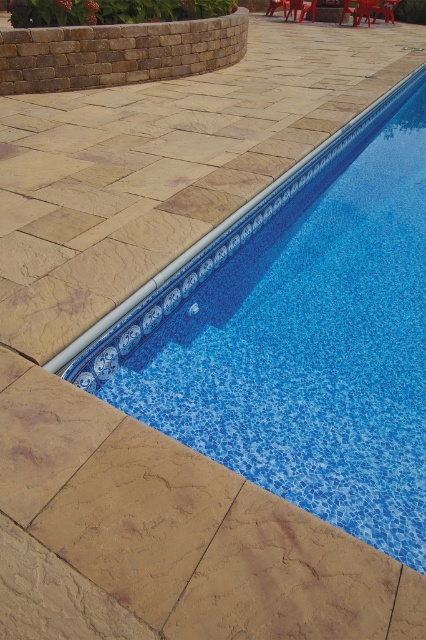
Question: Among these objects, which one is nearest to the camera?

Choices:
 (A) matte plastic chair at upper right
 (B) blue glossy pool at center
 (C) brown plastic chair at upper center

Answer: (B)

Question: Does blue glossy pool at center appear on the left side of wooden chair at upper center?

Choices:
 (A) no
 (B) yes

Answer: (B)

Question: Is blue glossy pool at center wider than wooden chair at upper center?

Choices:
 (A) no
 (B) yes

Answer: (B)

Question: Which of these objects is positioned farthest from the blue glossy pool at center?

Choices:
 (A) wooden chair at upper center
 (B) brown plastic chair at upper center
 (C) red plastic chair at upper right

Answer: (A)

Question: Does red plastic chair at upper right appear on the right side of wooden chair at upper center?

Choices:
 (A) no
 (B) yes

Answer: (B)

Question: Based on their relative distances, which object is nearer to the matte plastic chair at upper right?

Choices:
 (A) blue glossy pool at center
 (B) red plastic chair at upper right
 (C) brown plastic chair at upper center
 (D) wooden chair at upper center

Answer: (B)